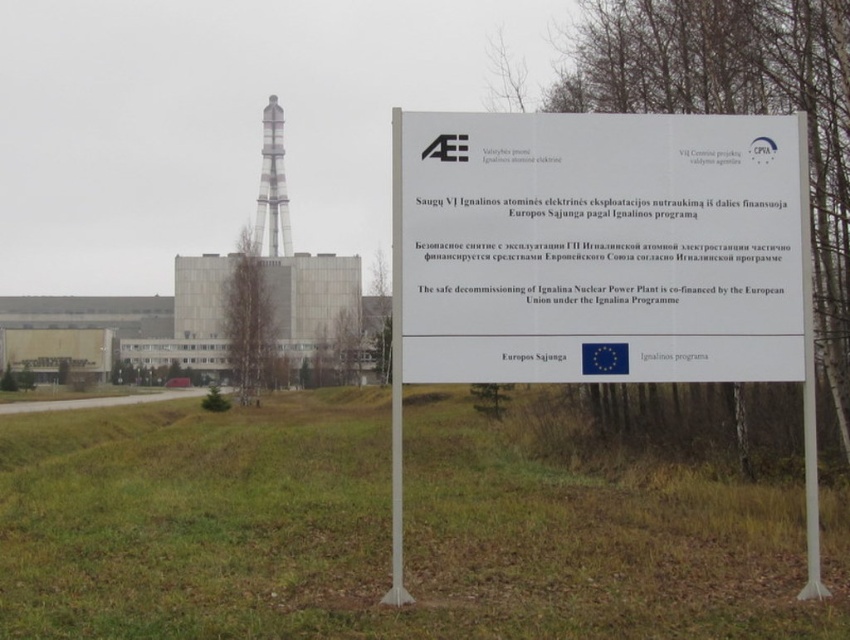
Who is positioned more to the left, green grass at center or white metallic pole at center?

From the viewer's perspective, green grass at center appears more on the left side.

Can you confirm if green grass at center is bigger than white metallic pole at center?

Yes.

Does point (162, 560) come closer to viewer compared to point (391, 595)?

No, it is behind (391, 595).

The image size is (850, 640). Identify the location of green grass at center. (378, 532).

Can you confirm if green grass at center is thinner than white paper sign at center?

In fact, green grass at center might be wider than white paper sign at center.

Who is lower down, green grass at center or white paper sign at center?

green grass at center is lower down.

Locate an element on the screen. The height and width of the screenshot is (640, 850). green grass at center is located at coordinates (378, 532).

Describe the element at coordinates (599, 260) in the screenshot. The image size is (850, 640). I see `white paper sign at center` at that location.

Can you confirm if white paper sign at center is positioned to the left of white plastic pole at center?

Yes, white paper sign at center is to the left of white plastic pole at center.

Is point (616, 305) closer to viewer compared to point (808, 330)?

Yes, point (616, 305) is in front of point (808, 330).

The width and height of the screenshot is (850, 640). Identify the location of white paper sign at center. (599, 260).